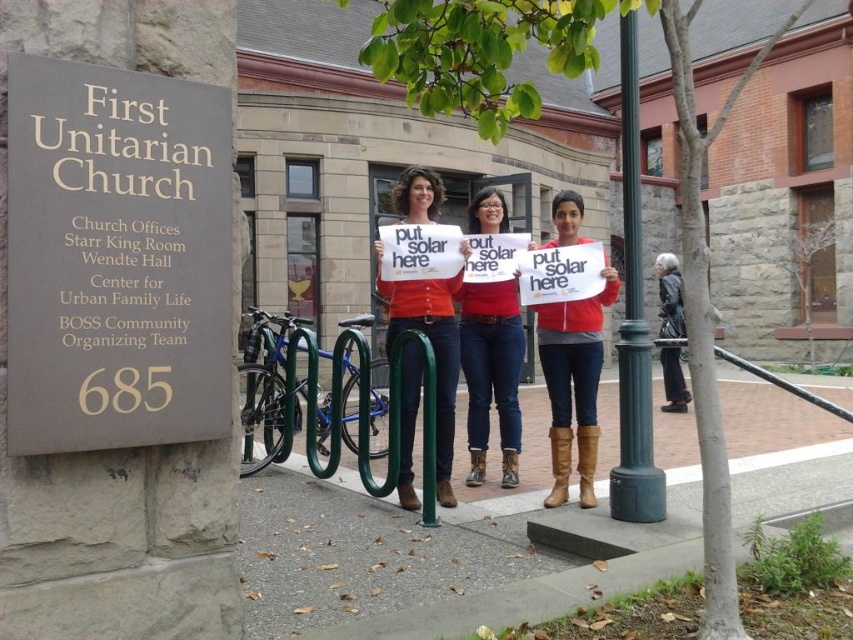
Between red zippered jacket at center and leather jacket at center, which one appears on the right side from the viewer's perspective?

leather jacket at center is more to the right.

Is point (561, 435) closer to viewer compared to point (685, 410)?

Yes, it is.

The image size is (853, 640). What do you see at coordinates (573, 381) in the screenshot?
I see `red zippered jacket at center` at bounding box center [573, 381].

The image size is (853, 640). Find the location of `red zippered jacket at center`. red zippered jacket at center is located at coordinates (573, 381).

Who is shorter, green painted metal pole at right or matte orange shirt at center?

green painted metal pole at right is shorter.

Which is behind, point (640, 262) or point (397, 480)?

Point (397, 480)

Does point (621, 164) come closer to viewer compared to point (416, 221)?

No, (621, 164) is further to viewer.

Where is `green painted metal pole at right`? green painted metal pole at right is located at coordinates 633,323.

The height and width of the screenshot is (640, 853). What do you see at coordinates (633, 323) in the screenshot?
I see `green painted metal pole at right` at bounding box center [633, 323].

Looking at this image, who is shorter, green painted metal pole at right or matte red shirt at center?

With less height is green painted metal pole at right.

Is point (624, 234) less distant than point (495, 324)?

No, it is behind (495, 324).

I want to click on green painted metal pole at right, so point(633,323).